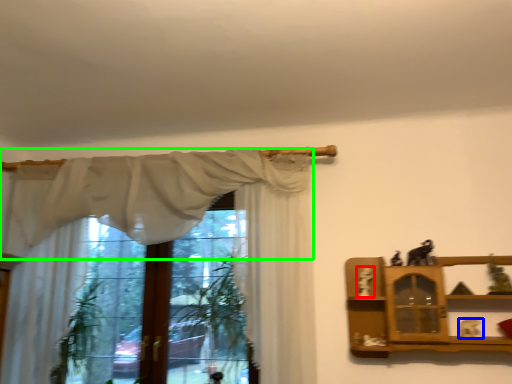
Question: Which is farther away from toy (highlighted by a red box)? toy (highlighted by a blue box) or curtain (highlighted by a green box)?

Choices:
 (A) toy
 (B) curtain

Answer: (B)